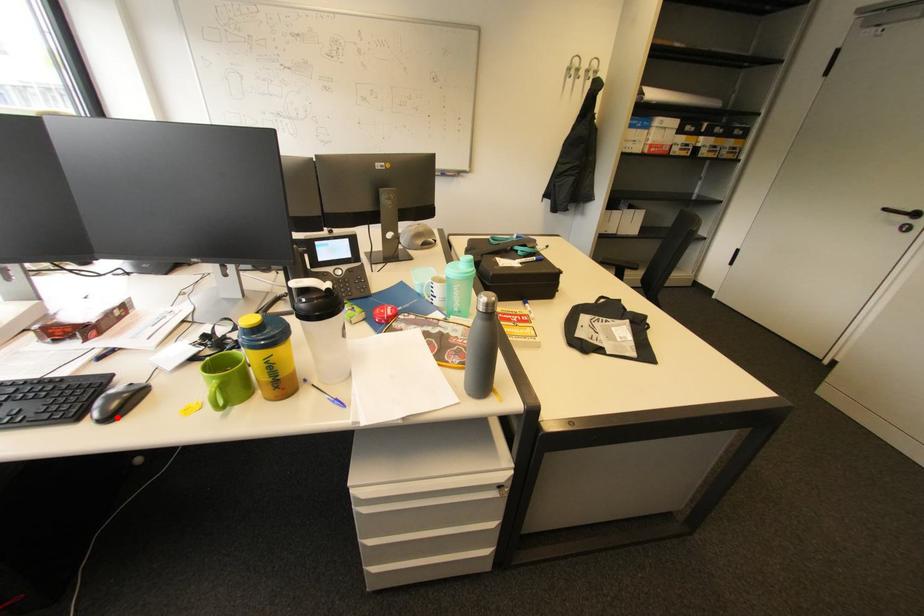
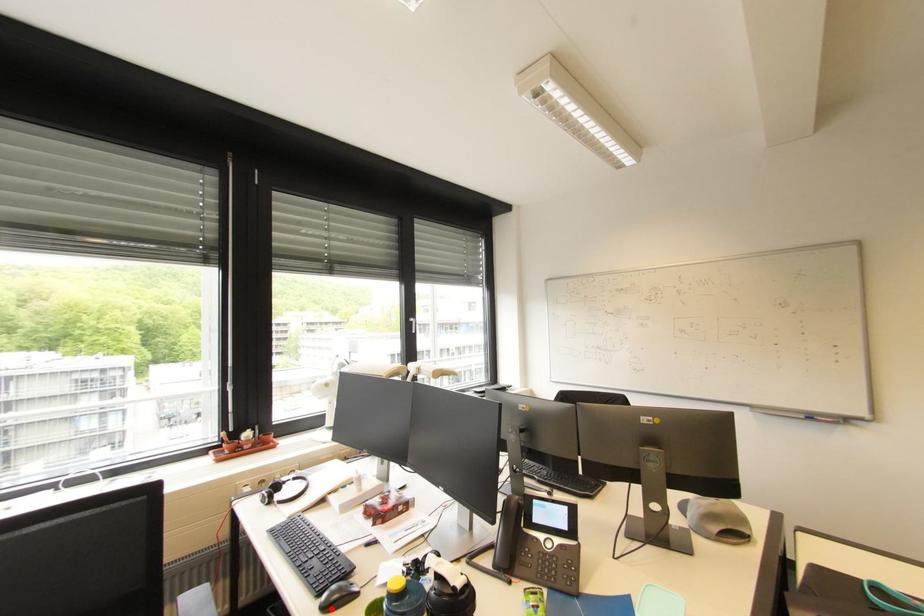
I am providing you with two images of the same scene from different viewpoints. A red point is marked on the first image and another point is marked on the second image. Does the point marked in image1 correspond to the same location as the one in image2?

Yes